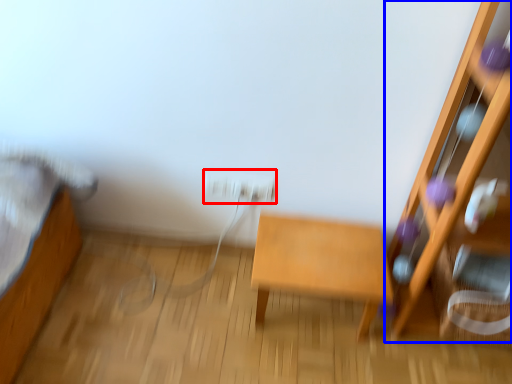
Question: Which object appears closest to the camera in this image, electric outlet (highlighted by a red box) or furniture (highlighted by a blue box)?

Choices:
 (A) electric outlet
 (B) furniture

Answer: (B)